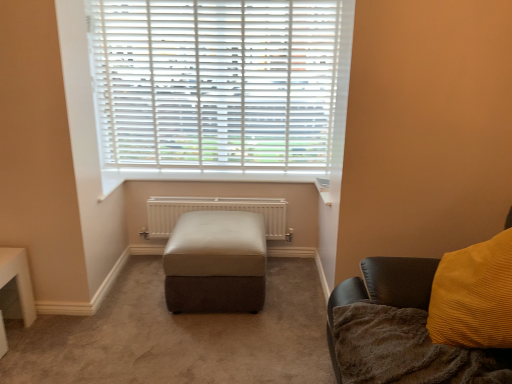
The width and height of the screenshot is (512, 384). Identify the location of free spot below white plastic blinds at upper center (from a real-world perspective). click(x=204, y=169).